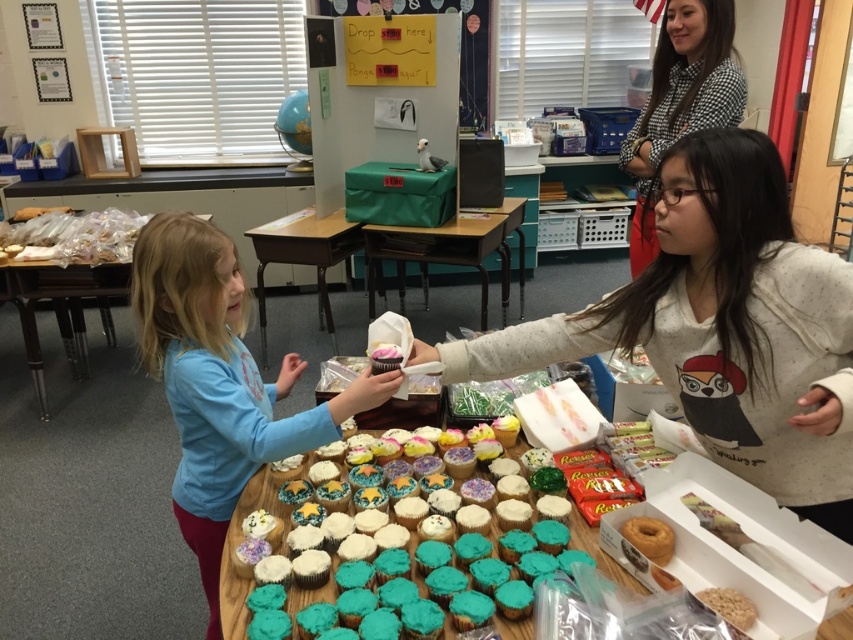
You are a student trying to grab a cupcake from the table. The matte blue shirt at center is part of your outfit. Can you fit through the space between your shirt and the green fabric table at center?

The matte blue shirt at center is thinner than the green fabric table at center, so yes, you can fit through the space between them since the shirt is thinner than the table.

You are a teacher observing the classroom activity. You notice the white speckled hoodie at center and the matte blue shirt at center. Which clothing item is positioned higher on the person?

The white speckled hoodie at center is above the matte blue shirt at center, so the hoodie is positioned higher.